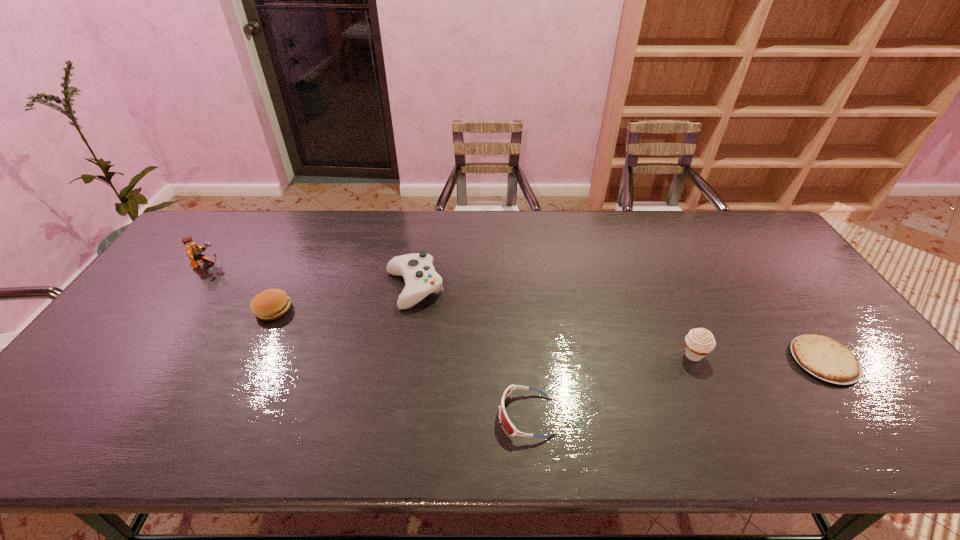
Find the location of `vacant space at the far edge of the desktop`. vacant space at the far edge of the desktop is located at coordinates (345, 227).

At what (x,y) coordinates should I click in order to perform the action: click on vacant space at the near edge. Please return your answer as a coordinate pair (x, y). Looking at the image, I should click on (346, 429).

Where is `vacant space at the left edge of the desktop`? vacant space at the left edge of the desktop is located at coordinates (86, 363).

I want to click on free space at the right edge of the desktop, so click(x=761, y=276).

What are the coordinates of `vacant region at the far left corner of the desktop` in the screenshot? It's located at (238, 226).

At what (x,y) coordinates should I click in order to perform the action: click on vacant area at the near left corner. Please return your answer as a coordinate pair (x, y). The image size is (960, 540). Looking at the image, I should click on (90, 422).

The width and height of the screenshot is (960, 540). What are the coordinates of `vacant region at the far right corner` in the screenshot? It's located at (758, 239).

The width and height of the screenshot is (960, 540). I want to click on blank region between the fifth object from left to right and the Lego, so click(x=450, y=311).

Locate an element on the screen. vacant space in between the goggles and the patty is located at coordinates (399, 363).

Locate an element on the screen. The height and width of the screenshot is (540, 960). vacant region between the Lego and the rightmost object is located at coordinates (516, 313).